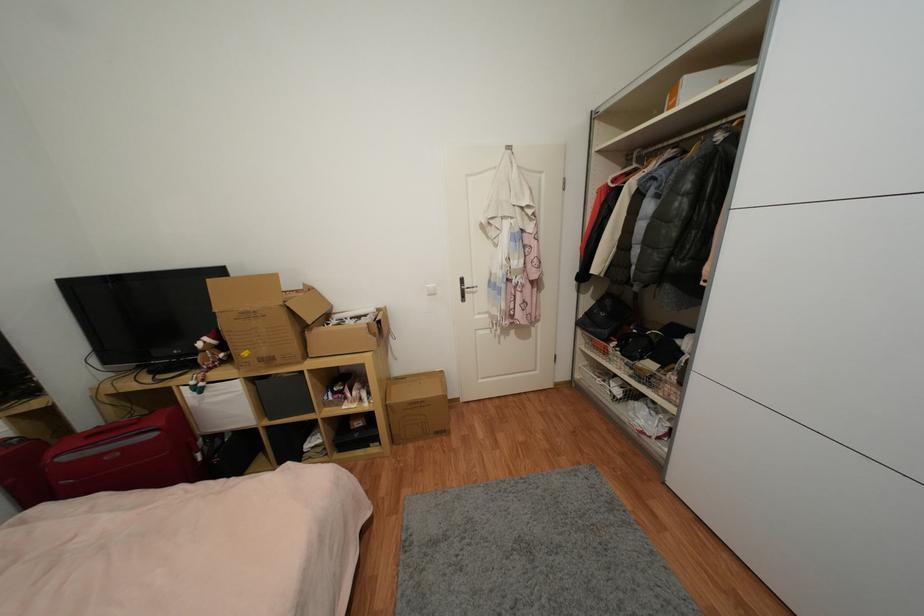
Where is `wire basket drawer`? This screenshot has width=924, height=616. wire basket drawer is located at coordinates (631, 381).